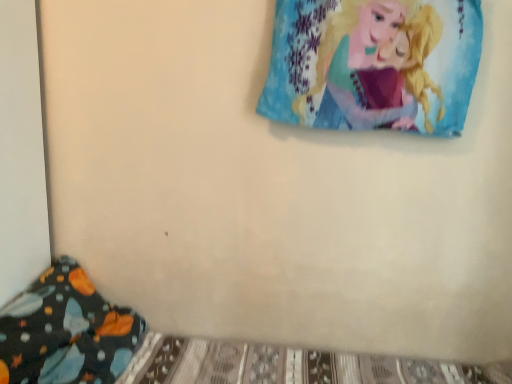
Question: Is blue fabric pillow at upper right at the back of dark blue fabric pillow at lower left?

Choices:
 (A) no
 (B) yes

Answer: (A)

Question: Is dark blue fabric pillow at lower left at the right side of blue fabric pillow at upper right?

Choices:
 (A) yes
 (B) no

Answer: (B)

Question: Does dark blue fabric pillow at lower left have a smaller size compared to blue fabric pillow at upper right?

Choices:
 (A) yes
 (B) no

Answer: (B)

Question: Is dark blue fabric pillow at lower left far from blue fabric pillow at upper right?

Choices:
 (A) no
 (B) yes

Answer: (B)

Question: From the image's perspective, is dark blue fabric pillow at lower left on top of blue fabric pillow at upper right?

Choices:
 (A) yes
 (B) no

Answer: (B)

Question: Is dark blue fabric pillow at lower left facing towards blue fabric pillow at upper right?

Choices:
 (A) no
 (B) yes

Answer: (A)

Question: Is blue fabric pillow at upper right further to camera compared to dark blue fabric pillow at lower left?

Choices:
 (A) no
 (B) yes

Answer: (B)

Question: Can you confirm if blue fabric pillow at upper right is smaller than dark blue fabric pillow at lower left?

Choices:
 (A) yes
 (B) no

Answer: (A)

Question: Could you tell me if blue fabric pillow at upper right is turned towards dark blue fabric pillow at lower left?

Choices:
 (A) no
 (B) yes

Answer: (A)

Question: Can you confirm if blue fabric pillow at upper right is bigger than dark blue fabric pillow at lower left?

Choices:
 (A) no
 (B) yes

Answer: (A)

Question: Are blue fabric pillow at upper right and dark blue fabric pillow at lower left located far from each other?

Choices:
 (A) no
 (B) yes

Answer: (B)

Question: Does blue fabric pillow at upper right have a greater width compared to dark blue fabric pillow at lower left?

Choices:
 (A) yes
 (B) no

Answer: (B)

Question: From a real-world perspective, relative to blue fabric pillow at upper right, is dark blue fabric pillow at lower left vertically above or below?

Choices:
 (A) above
 (B) below

Answer: (B)